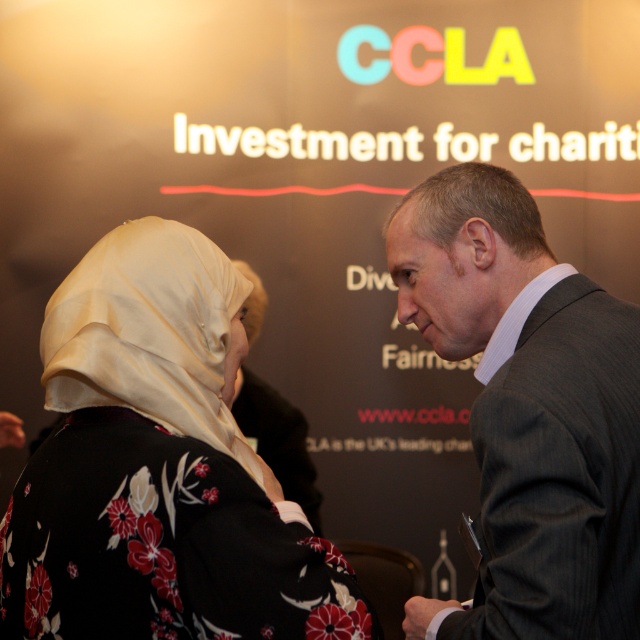
Is silky beige hijab at left closer to camera compared to dark gray suit at right?

Yes, it is in front of dark gray suit at right.

Where is `silky beige hijab at left`? The width and height of the screenshot is (640, 640). silky beige hijab at left is located at coordinates (157, 467).